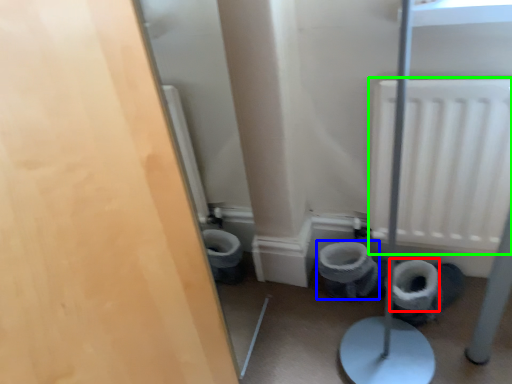
Question: Which object is positioned farthest from toilet paper (highlighted by a red box)? Select from toilet bowl (highlighted by a blue box) and radiator (highlighted by a green box).

Choices:
 (A) toilet bowl
 (B) radiator

Answer: (B)